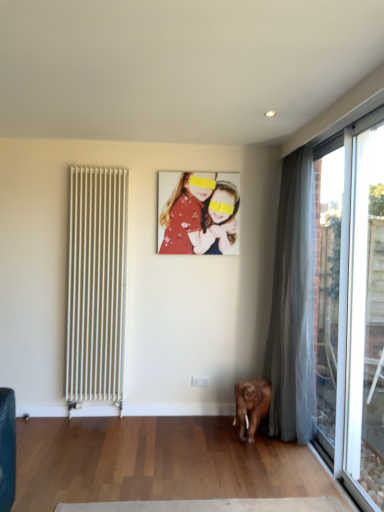
Find the location of a particular element. vacant area on top of white metal radiator at left (from a real-world perspective) is located at coordinates tap(97, 167).